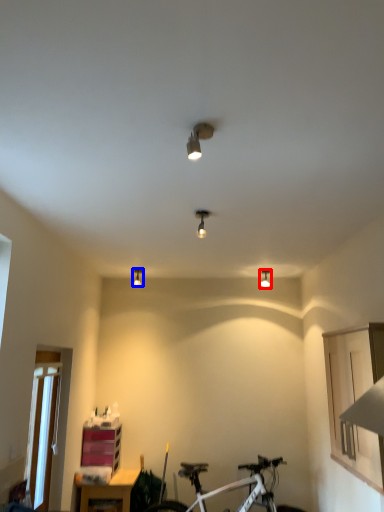
Question: Which point is further to the camera, light fixture (highlighted by a red box) or light fixture (highlighted by a blue box)?

Choices:
 (A) light fixture
 (B) light fixture

Answer: (B)